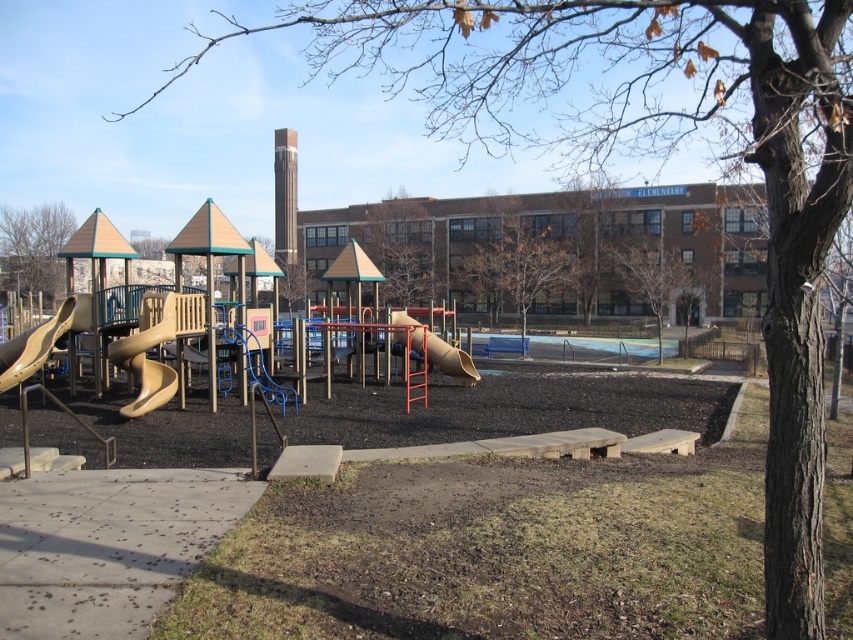
In the scene shown: You are a parent trying to locate your child who is playing on the playground. You see the brown leafless tree at center and the matte yellow slide at left. Which object is closer to you based on their positions?

The brown leafless tree at center is closer to you because the matte yellow slide at left is positioned behind it.

You are standing at the camera position and want to walk to the brown leafless tree at center. If your walking speed is 1.5 meters per second, how long will it take you to reach the tree?

The distance between you and the brown leafless tree at center is 51.87 meters. At a speed of 1.5 meters per second, it would take approximately 34.58 seconds to reach the tree. Since we usually round to the nearest whole number, it would take about 35 seconds.

You are standing at the playground in front of Hofferson Elementary. There are two points marked on the ground at coordinates point (444, 362) and point (163, 364). If you want to walk from the closer point to the farther point from your current position, which point should you start at and which should you end at?

You should start at point (163, 364) and end at point (444, 362) because point (444, 362) is further away from you than point (163, 364).